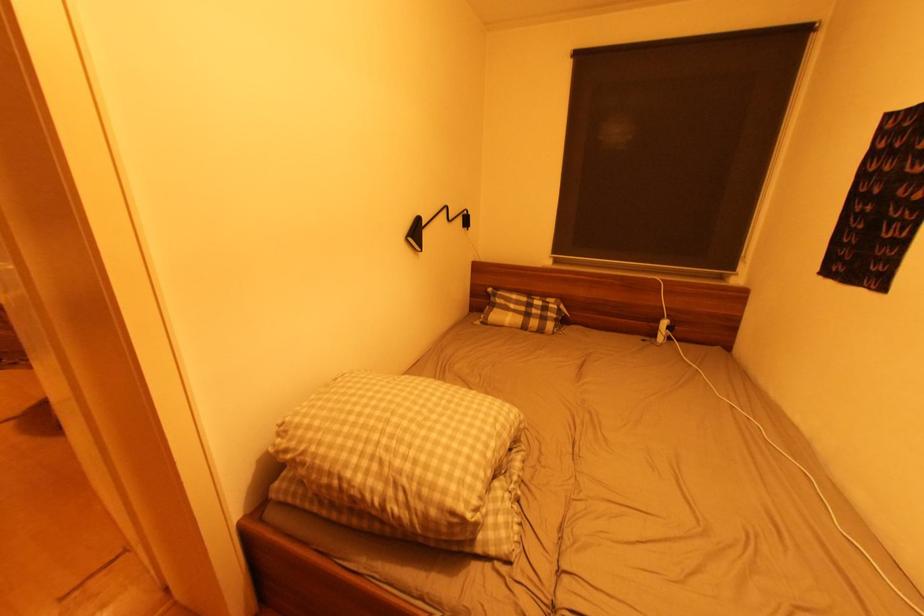
Find where to adjust the black lamp head. Please return your answer as a coordinate pair (x, y).

(417, 233)